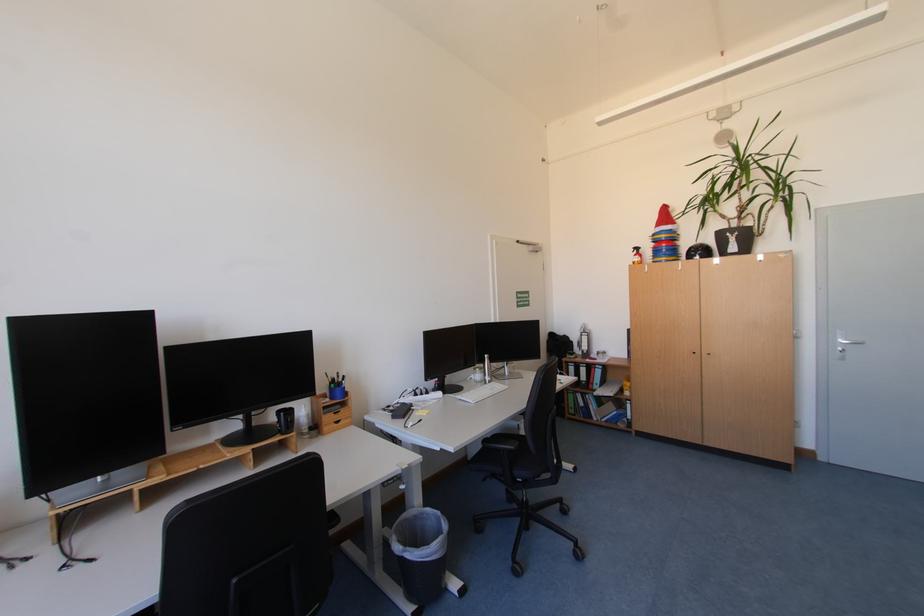
The width and height of the screenshot is (924, 616). Identify the location of blue binder. [x=598, y=377].